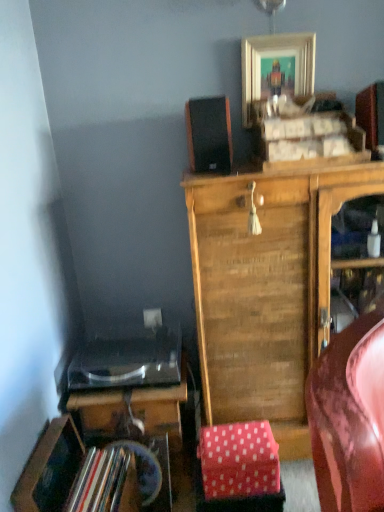
This screenshot has width=384, height=512. In order to click on free space in front of black matte speaker at upper center in this screenshot , I will do `click(221, 173)`.